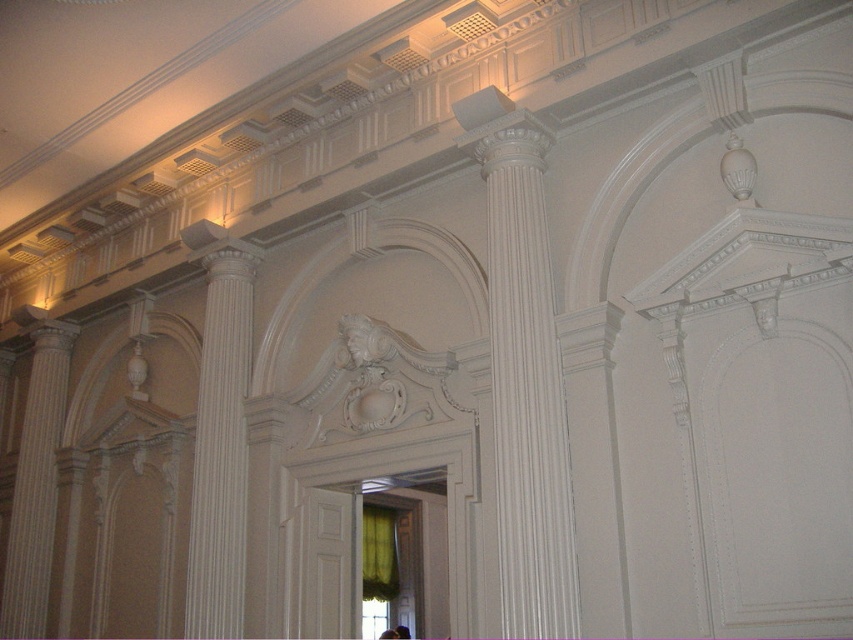
You are an interior designer assessing the symmetry of the classical building. You see the white glossy column at center and the white glossy column at left. Which column is positioned to the right of the other?

The white glossy column at center is positioned to the right of the white glossy column at left.

You are an interior designer assessing the symmetry of the classical building. You notice two white glossy columns in the scene. Which column, the white glossy column at center or the white glossy column at left, appears taller?

The white glossy column at center appears taller than the white glossy column at left according to the description.